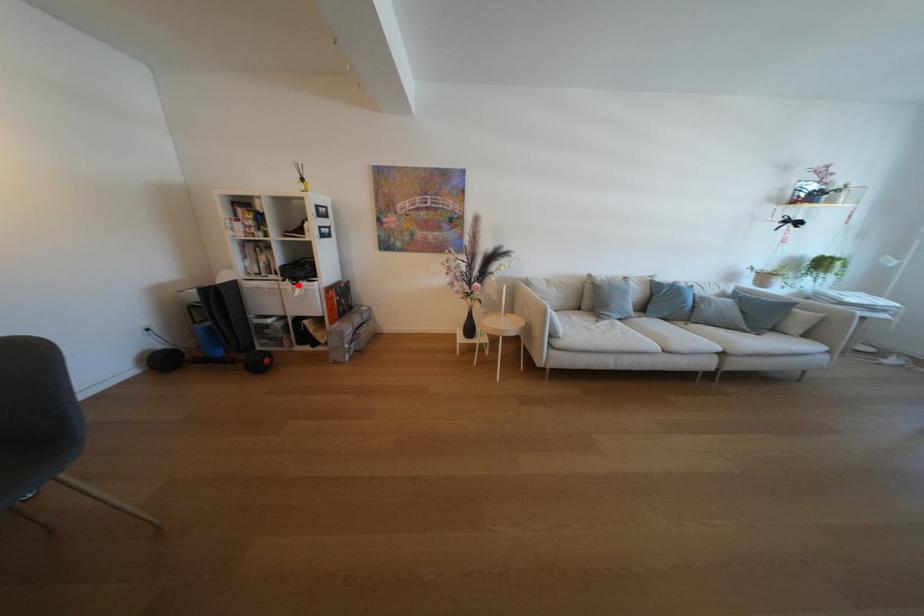
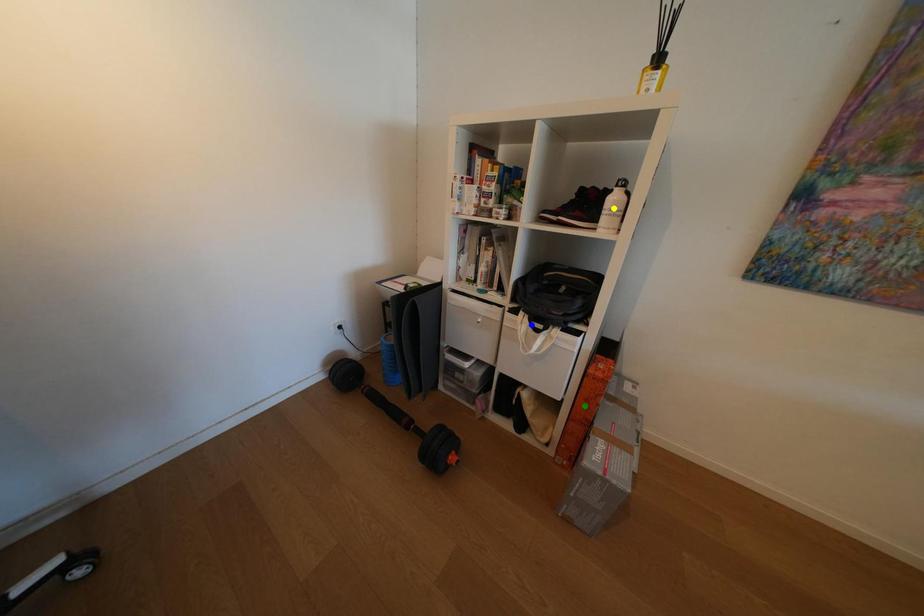
Question: I am providing you with two images of the same scene from different viewpoints. A red point is marked on the first image. You are given multiple points on the second image. Which mark in image 2 goes with the point in image 1?

Choices:
 (A) yellow point
 (B) blue point
 (C) green point

Answer: (B)